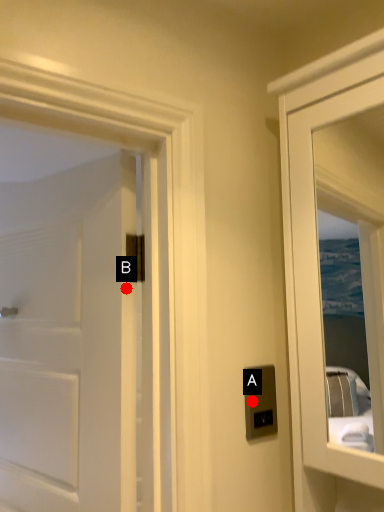
Question: Two points are circled on the image, labeled by A and B beside each circle. Which point is further to the camera?

Choices:
 (A) A is further
 (B) B is further

Answer: (B)